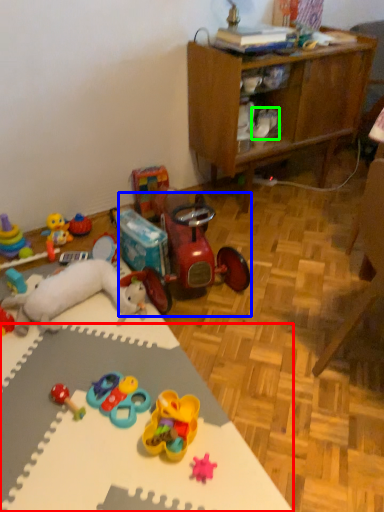
Question: Based on their relative distances, which object is farther from desk (highlighted by a red box)? Choose from toy (highlighted by a blue box) and footwear (highlighted by a green box).

Choices:
 (A) toy
 (B) footwear

Answer: (B)